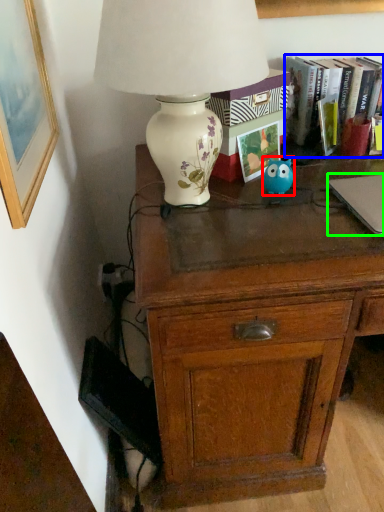
Question: Estimate the real-world distances between objects in this image. Which object is closer to animal (highlighted by a red box), book (highlighted by a blue box) or laptop (highlighted by a green box)?

Choices:
 (A) book
 (B) laptop

Answer: (B)